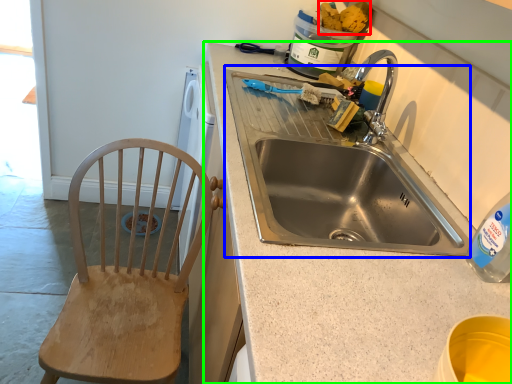
Question: Which object is positioned farthest from food (highlighted by a red box)? Select from sink (highlighted by a blue box) and countertop (highlighted by a green box).

Choices:
 (A) sink
 (B) countertop

Answer: (B)